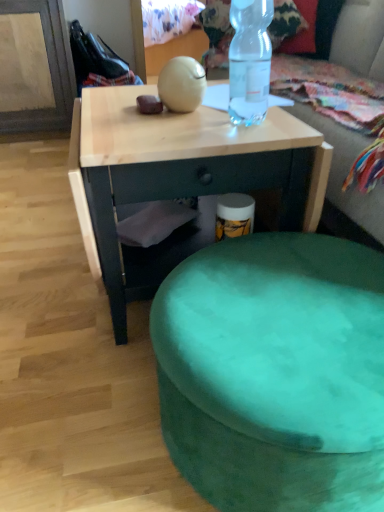
Locate an element on the screen. The image size is (384, 512). free space above natural wood desk at center (from a real-world perspective) is located at coordinates (158, 109).